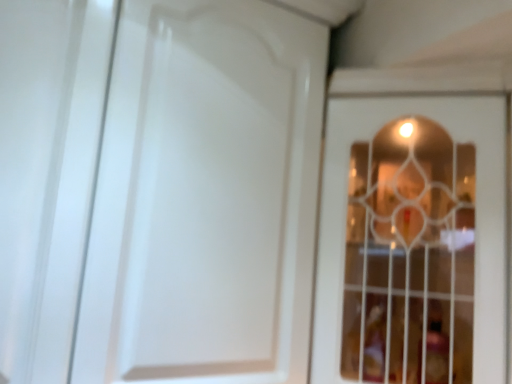
I want to click on white glass door at center, the 2th door from the left, so click(412, 241).

What do you see at coordinates (412, 241) in the screenshot? Image resolution: width=512 pixels, height=384 pixels. I see `white glass door at center, the 2th door from the left` at bounding box center [412, 241].

What do you see at coordinates (205, 197) in the screenshot?
I see `white glossy door at center, the 1th door from the left` at bounding box center [205, 197].

At what (x,y) coordinates should I click in order to perform the action: click on white glossy door at center, which is the second door from right to left. Please return your answer as a coordinate pair (x, y). This screenshot has height=384, width=512. Looking at the image, I should click on (205, 197).

Image resolution: width=512 pixels, height=384 pixels. In order to click on white glass door at center, the first door positioned from the right in this screenshot , I will do `click(412, 241)`.

Considering the positions of objects white glossy door at center, which is the second door from right to left, and white glass door at center, the first door positioned from the right, in the image provided, who is more to the left, white glossy door at center, which is the second door from right to left, or white glass door at center, the first door positioned from the right,?

From the viewer's perspective, white glossy door at center, which is the second door from right to left, appears more on the left side.

Is white glossy door at center, the 1th door from the left, positioned behind white glass door at center, the 2th door from the left?

Yes, white glossy door at center, the 1th door from the left, is further from the camera.

Which point is more forward, (211, 228) or (348, 152)?

The point (211, 228) is more forward.

From the image's perspective, relative to white glass door at center, the first door positioned from the right, is white glossy door at center, which is the second door from right to left, above or below?

white glossy door at center, which is the second door from right to left, is situated higher than white glass door at center, the first door positioned from the right, in the image.

From a real-world perspective, is white glossy door at center, which is the second door from right to left, positioned over white glass door at center, the first door positioned from the right, based on gravity?

Yes, from a real-world perspective, white glossy door at center, which is the second door from right to left, is above white glass door at center, the first door positioned from the right.

Considering the sizes of white glossy door at center, which is the second door from right to left, and white glass door at center, the first door positioned from the right, in the image, is white glossy door at center, which is the second door from right to left, wider or thinner than white glass door at center, the first door positioned from the right,?

Considering their sizes, white glossy door at center, which is the second door from right to left, looks slimmer than white glass door at center, the first door positioned from the right.

Which of these two, white glossy door at center, which is the second door from right to left, or white glass door at center, the 2th door from the left, stands shorter?

white glass door at center, the 2th door from the left, is shorter.

Can you confirm if white glossy door at center, the 1th door from the left, is bigger than white glass door at center, the first door positioned from the right?

Indeed, white glossy door at center, the 1th door from the left, has a larger size compared to white glass door at center, the first door positioned from the right.

In the scene shown: Is white glossy door at center, the 1th door from the left, situated inside white glass door at center, the 2th door from the left, or outside?

white glossy door at center, the 1th door from the left, cannot be found inside white glass door at center, the 2th door from the left.

Are white glossy door at center, the 1th door from the left, and white glass door at center, the 2th door from the left, located far from each other?

No, there isn't a large distance between white glossy door at center, the 1th door from the left, and white glass door at center, the 2th door from the left.

Is white glossy door at center, the 1th door from the left, turned away from white glass door at center, the 2th door from the left?

No, white glossy door at center, the 1th door from the left,'s orientation is not away from white glass door at center, the 2th door from the left.

This screenshot has height=384, width=512. I want to click on door above the white glass door at center, the first door positioned from the right (from the image's perspective), so click(205, 197).

Considering the positions of objects white glass door at center, the 2th door from the left, and white glossy door at center, which is the second door from right to left, in the image provided, who is more to the right, white glass door at center, the 2th door from the left, or white glossy door at center, which is the second door from right to left,?

white glass door at center, the 2th door from the left, is more to the right.

In the scene shown: Does white glass door at center, the 2th door from the left, lie behind white glossy door at center, the 1th door from the left?

No, white glass door at center, the 2th door from the left, is closer to the viewer.

Between point (414, 199) and point (134, 290), which one is positioned behind?

Point (414, 199)

From the image's perspective, which is above, white glass door at center, the 2th door from the left, or white glossy door at center, the 1th door from the left?

From the image's view, white glossy door at center, the 1th door from the left, is above.

From a real-world perspective, which is physically above, white glass door at center, the 2th door from the left, or white glossy door at center, which is the second door from right to left?

In real-world perspective, white glossy door at center, which is the second door from right to left, is above.

Is white glass door at center, the first door positioned from the right, wider than white glossy door at center, the 1th door from the left?

Yes.

Considering the sizes of white glass door at center, the first door positioned from the right, and white glossy door at center, the 1th door from the left, in the image, is white glass door at center, the first door positioned from the right, taller or shorter than white glossy door at center, the 1th door from the left,?

Considering their sizes, white glass door at center, the first door positioned from the right, has less height than white glossy door at center, the 1th door from the left.

Can you confirm if white glass door at center, the first door positioned from the right, is smaller than white glossy door at center, the 1th door from the left?

Yes.

Can we say white glass door at center, the 2th door from the left, lies outside white glossy door at center, the 1th door from the left?

Indeed, white glass door at center, the 2th door from the left, is completely outside white glossy door at center, the 1th door from the left.

Based on the photo, is white glass door at center, the first door positioned from the right, touching white glossy door at center, the 1th door from the left?

No, white glass door at center, the first door positioned from the right, is not next to white glossy door at center, the 1th door from the left.

Looking at this image, could you tell me if white glass door at center, the first door positioned from the right, is facing white glossy door at center, the 1th door from the left?

Yes, white glass door at center, the first door positioned from the right, is turned towards white glossy door at center, the 1th door from the left.

How different are the orientations of white glass door at center, the 2th door from the left, and white glossy door at center, which is the second door from right to left, in degrees?

The angle between the facing direction of white glass door at center, the 2th door from the left, and the facing direction of white glossy door at center, which is the second door from right to left, is 89.4 degrees.

The width and height of the screenshot is (512, 384). I want to click on door that appears above the white glass door at center, the first door positioned from the right (from a real-world perspective), so click(x=205, y=197).

In order to click on door below the white glossy door at center, the 1th door from the left (from the image's perspective) in this screenshot , I will do `click(412, 241)`.

Where is `door positioned vertically above the white glass door at center, the first door positioned from the right (from a real-world perspective)`? door positioned vertically above the white glass door at center, the first door positioned from the right (from a real-world perspective) is located at coordinates (205, 197).